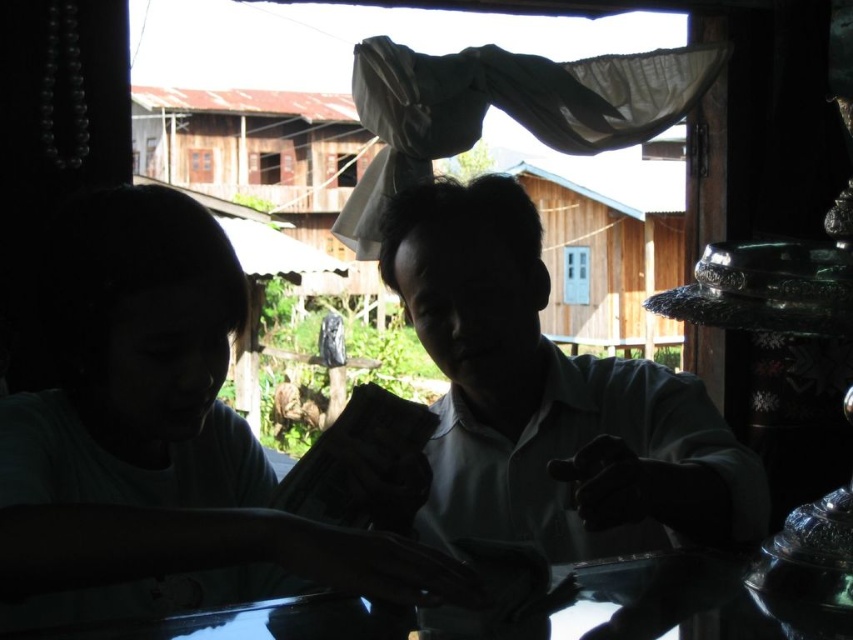
You are standing at the entrance of the wooden structure and want to hand a small item to the person wearing the white glossy shirt at center. Based on their position coordinates, in which direction should you move to reach them?

The white glossy shirt at center is located at coordinates point (x=550, y=401). Since the coordinate system typically places (x=0, y=0) at the bottom left corner and (x=852, y=639) at the top right corner, moving towards the upper right direction from your current position at the entrance would allow you to reach the white glossy shirt at center.

You are standing at the origin point in the image. Which of the two points, point (209, 488) or point (445, 634), is farther away from you?

Point (209, 488) is behind point (445, 634), so it is farther away from you.